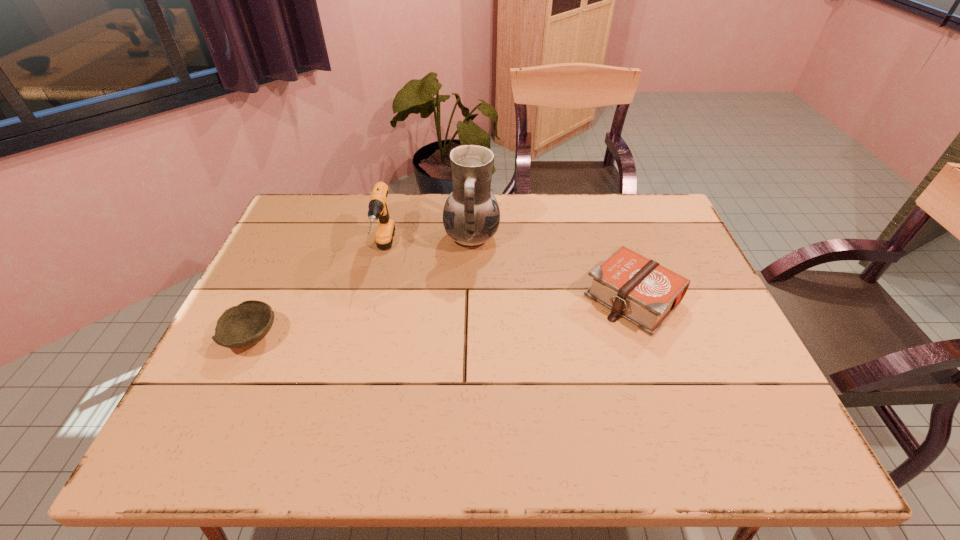
Where is `vacant space that's between the third object from right to left and the Bible`? vacant space that's between the third object from right to left and the Bible is located at coordinates (509, 275).

Identify which object is located as the nearest to the second object from right to left. Please provide its 2D coordinates. Your answer should be formatted as a tuple, i.e. [(x, y)], where the tuple contains the x and y coordinates of a point satisfying the conditions above.

[(378, 209)]

Find the location of a particular element. object that stands as the third closest to the drill is located at coordinates (640, 290).

Find the location of a particular element. The height and width of the screenshot is (540, 960). free spot that satisfies the following two spatial constraints: 1. at the tip of the drill; 2. on the right side of the rightmost object is located at coordinates (372, 299).

Where is `free space that satisfies the following two spatial constraints: 1. on the front-facing side of the tallest object; 2. at the tip of the third object from right to left`? The width and height of the screenshot is (960, 540). free space that satisfies the following two spatial constraints: 1. on the front-facing side of the tallest object; 2. at the tip of the third object from right to left is located at coordinates (471, 252).

Where is `vacant region that satisfies the following two spatial constraints: 1. at the tip of the third object from right to left; 2. on the left side of the Bible`? The height and width of the screenshot is (540, 960). vacant region that satisfies the following two spatial constraints: 1. at the tip of the third object from right to left; 2. on the left side of the Bible is located at coordinates (372, 299).

Image resolution: width=960 pixels, height=540 pixels. Find the location of `free space that satisfies the following two spatial constraints: 1. at the tip of the rightmost object; 2. on the left side of the second object from left to right`. free space that satisfies the following two spatial constraints: 1. at the tip of the rightmost object; 2. on the left side of the second object from left to right is located at coordinates (372, 299).

Locate an element on the screen. The height and width of the screenshot is (540, 960). vacant point that satisfies the following two spatial constraints: 1. on the front-facing side of the third object from left to right; 2. at the tip of the drill is located at coordinates 471,252.

Image resolution: width=960 pixels, height=540 pixels. Find the location of `vacant area that satisfies the following two spatial constraints: 1. on the front-facing side of the third object from left to right; 2. on the back side of the second shortest object`. vacant area that satisfies the following two spatial constraints: 1. on the front-facing side of the third object from left to right; 2. on the back side of the second shortest object is located at coordinates (470, 299).

I want to click on vacant space that satisfies the following two spatial constraints: 1. on the front-facing side of the second object from right to left; 2. at the tip of the third shortest object, so click(471, 252).